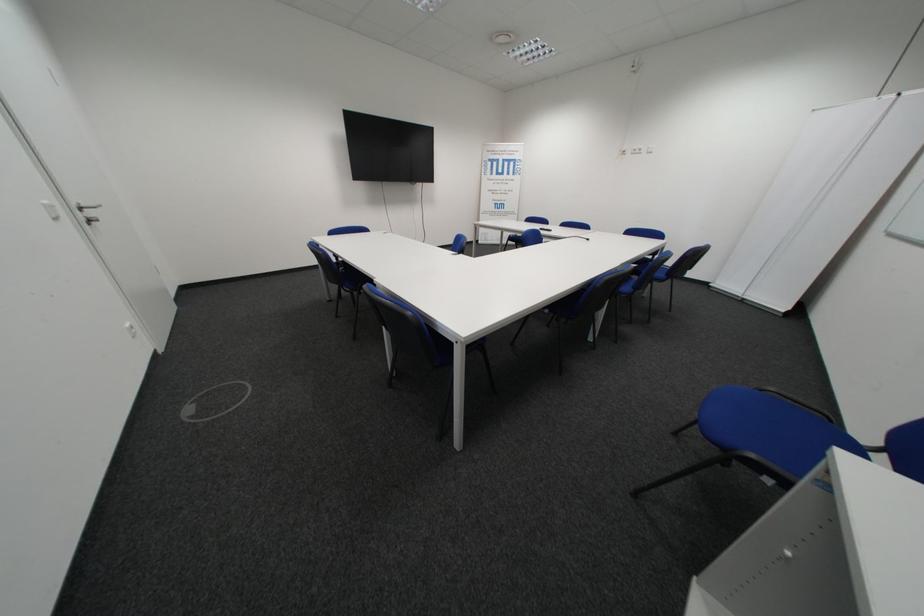
Identify the location of blue chair sitting surface. (767, 427).